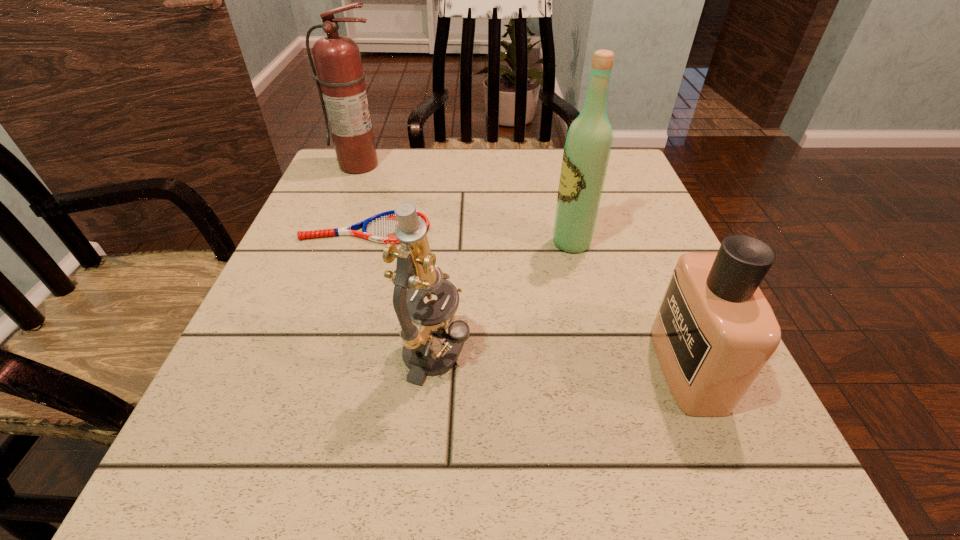
The width and height of the screenshot is (960, 540). I want to click on wine bottle, so click(x=588, y=144).

Where is `the farthest object`? The width and height of the screenshot is (960, 540). the farthest object is located at coordinates (340, 81).

At what (x,y) coordinates should I click in order to perform the action: click on the third shortest object. Please return your answer as a coordinate pair (x, y). The width and height of the screenshot is (960, 540). Looking at the image, I should click on (416, 276).

The image size is (960, 540). I want to click on the second shortest object, so click(x=714, y=332).

Identify the location of perfume. (714, 332).

Where is `tennis racket`? tennis racket is located at coordinates (380, 228).

Where is `blank space located 0.210m on the front-facing side of the fourth object from left to right`? The image size is (960, 540). blank space located 0.210m on the front-facing side of the fourth object from left to right is located at coordinates (448, 243).

The width and height of the screenshot is (960, 540). Identify the location of vacant space located on the front-facing side of the fourth object from left to right. (385, 243).

Image resolution: width=960 pixels, height=540 pixels. Identify the location of vacant area situated 0.080m on the front-facing side of the fourth object from left to right. (513, 243).

What are the coordinates of `blank space located 0.060m on the front-facing side of the farthest object` in the screenshot? It's located at (350, 188).